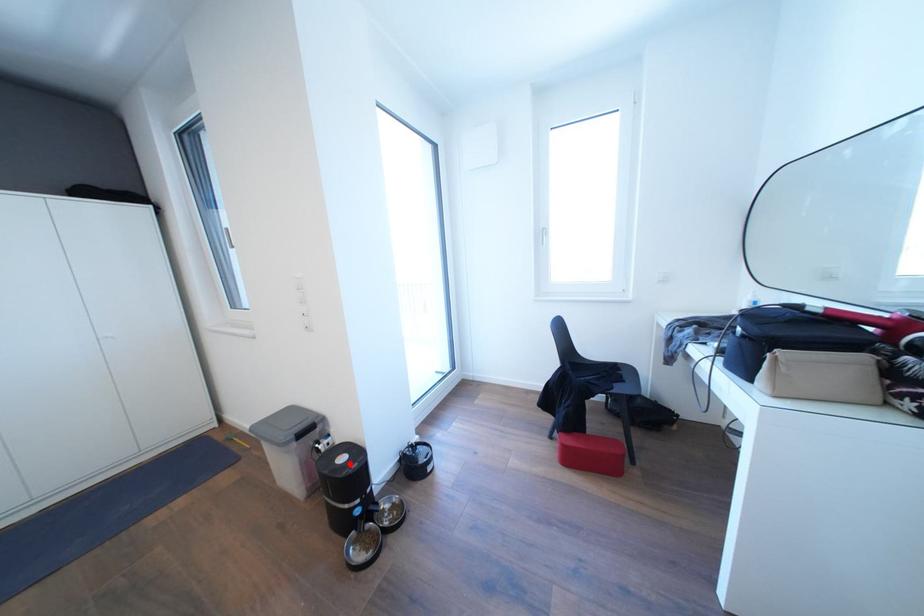
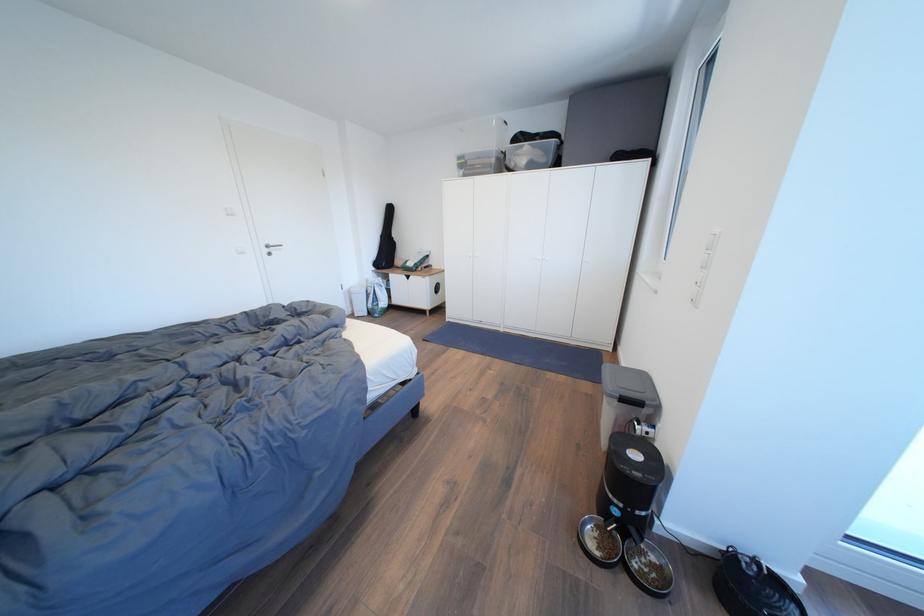
Question: I am providing you with two images of the same scene from different viewpoints. In image1, a red point is highlighted. Considering the same 3D point in image2, which of the following is correct?

Choices:
 (A) It is closer
 (B) It is farther

Answer: (A)